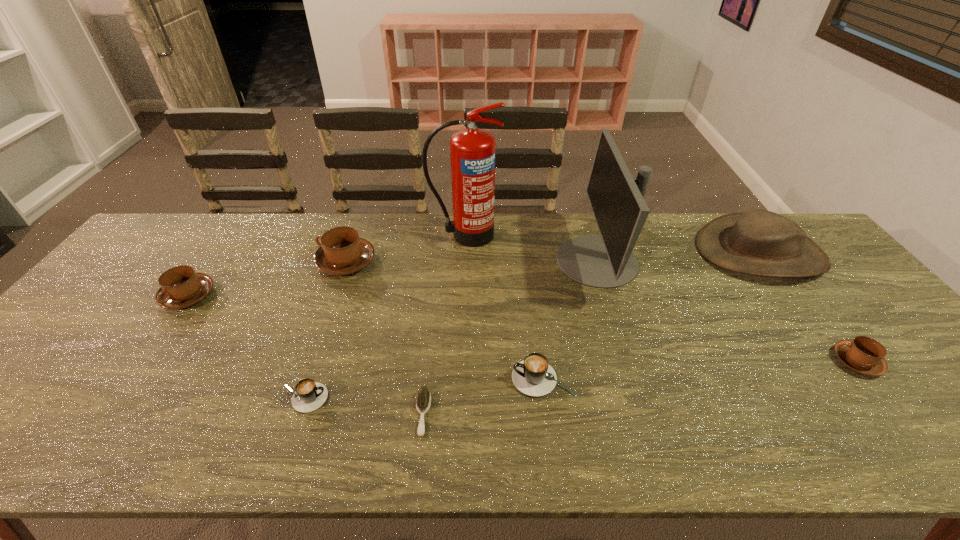
At what (x,y) coordinates should I click in order to perform the action: click on cappuccino at the right edge. Please return your answer as a coordinate pair (x, y). The width and height of the screenshot is (960, 540). Looking at the image, I should click on (864, 355).

The image size is (960, 540). I want to click on object present at the far right corner, so click(758, 242).

The image size is (960, 540). In the image, there is a desktop. Find the location of `vacant space at the far edge`. vacant space at the far edge is located at coordinates (555, 214).

Where is `free space at the near edge of the desktop`? free space at the near edge of the desktop is located at coordinates (728, 426).

The width and height of the screenshot is (960, 540). Identify the location of vacant area at the left edge of the desktop. (108, 314).

In the image, there is a desktop. Identify the location of vacant space at the right edge. (919, 359).

Identify the location of free location at the far left corner of the desktop. (205, 224).

This screenshot has height=540, width=960. I want to click on empty space between the sixth object from left to right and the tallest object, so click(x=504, y=307).

Image resolution: width=960 pixels, height=540 pixels. What are the coordinates of `empty space that is in between the rightmost brown cappuccino and the right black cappuccino` in the screenshot? It's located at (700, 370).

Find the location of a particular element. This screenshot has height=540, width=960. vacant region between the smallest brown cappuccino and the shortest object is located at coordinates (639, 387).